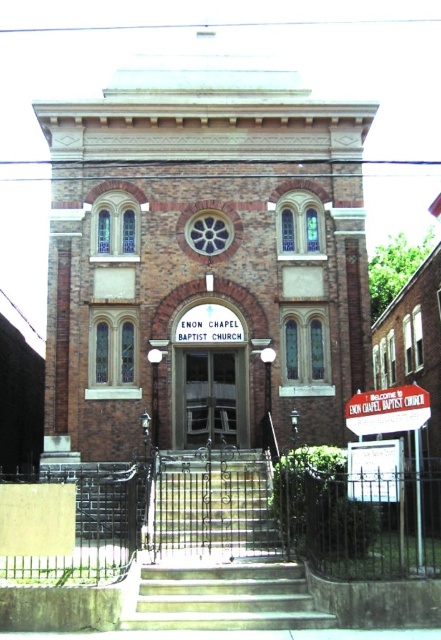
You are standing at the main entrance of Enon Chapel Baptist Church and see two points marked on the facade. One is at point coordinates point (169, 160) and the other at point (367, 449). Which point is closer to you?

Point (367, 449) is closer to you because it is in front of point (169, 160).

You are standing at a distance from the brown brick chapel at center. If you want to take a photo of the entire chapel without moving closer, what should you do with your camera?

Since the brown brick chapel at center is 52.58 meters away from the camera, you should use a wide angle lens to capture the entire structure in one shot.